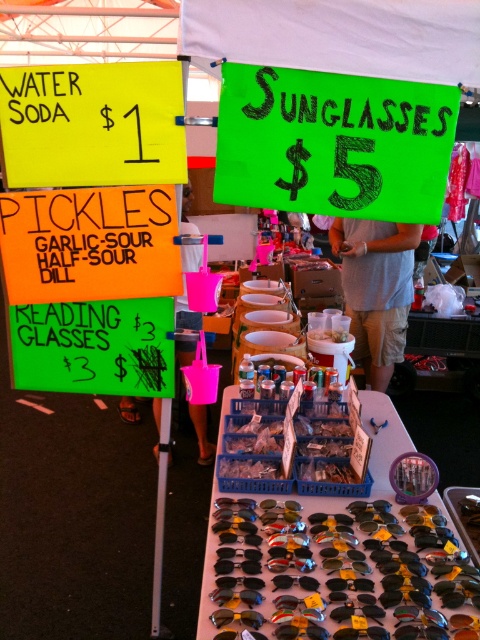
Question: Which point is closer to the camera?

Choices:
 (A) (202, 256)
 (B) (403, 81)

Answer: (B)

Question: Where is gray cotton shirt at center located in relation to pink fabric bag at lower center in the image?

Choices:
 (A) above
 (B) below

Answer: (B)

Question: Which object is positioned farthest from the green paper sign at upper right?

Choices:
 (A) black plastic goggles at center
 (B) matte black sunglasses at center

Answer: (B)

Question: Can you confirm if green paper sign at upper right is positioned below shiny black sunglasses at center?

Choices:
 (A) no
 (B) yes

Answer: (A)

Question: Which of these objects is positioned closest to the sour garlic pickles at center?

Choices:
 (A) black plastic goggles at center
 (B) gray cotton shirt at center

Answer: (A)

Question: Does matte black sunglasses at center appear over black plastic goggles at center?

Choices:
 (A) yes
 (B) no

Answer: (B)